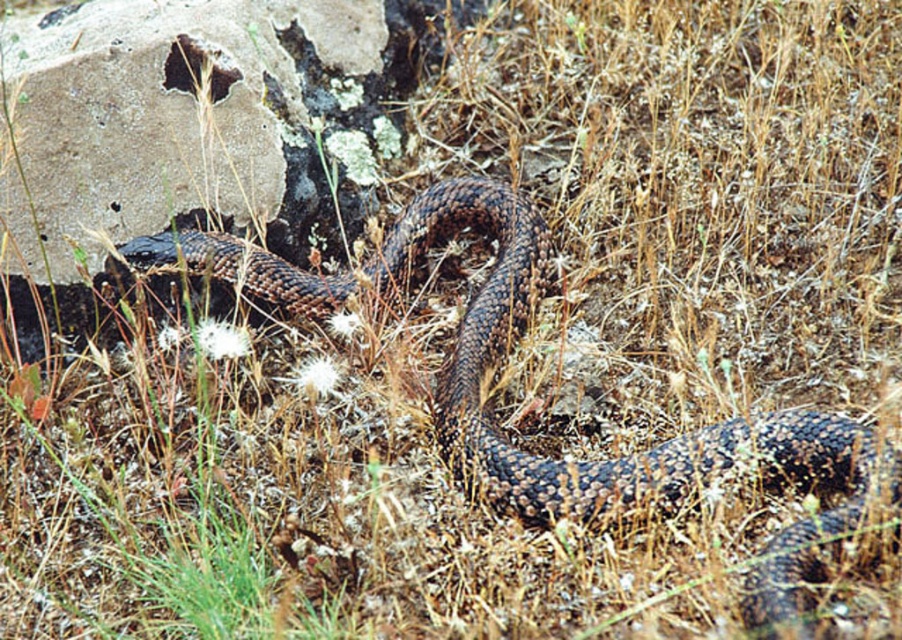
Who is taller, brown scaly snake at center or dark brown rock at upper left?

brown scaly snake at center

At what (x,y) coordinates should I click in order to perform the action: click on brown scaly snake at center. Please return your answer as a coordinate pair (x, y). The image size is (902, 640). Looking at the image, I should click on (500, 362).

Where is `brown scaly snake at center`? brown scaly snake at center is located at coordinates (500, 362).

The width and height of the screenshot is (902, 640). Describe the element at coordinates (194, 120) in the screenshot. I see `rough concrete boulder at left` at that location.

Who is more distant from viewer, (90, 102) or (493, 490)?

Point (90, 102)

Image resolution: width=902 pixels, height=640 pixels. What are the coordinates of `rough concrete boulder at left` in the screenshot? It's located at (194, 120).

The width and height of the screenshot is (902, 640). What do you see at coordinates (194, 120) in the screenshot? I see `rough concrete boulder at left` at bounding box center [194, 120].

Consider the image. Does rough concrete boulder at left appear under dark brown rock at upper left?

Actually, rough concrete boulder at left is above dark brown rock at upper left.

Is point (284, 60) behind point (219, 70)?

Yes, it is behind point (219, 70).

This screenshot has width=902, height=640. I want to click on rough concrete boulder at left, so click(194, 120).